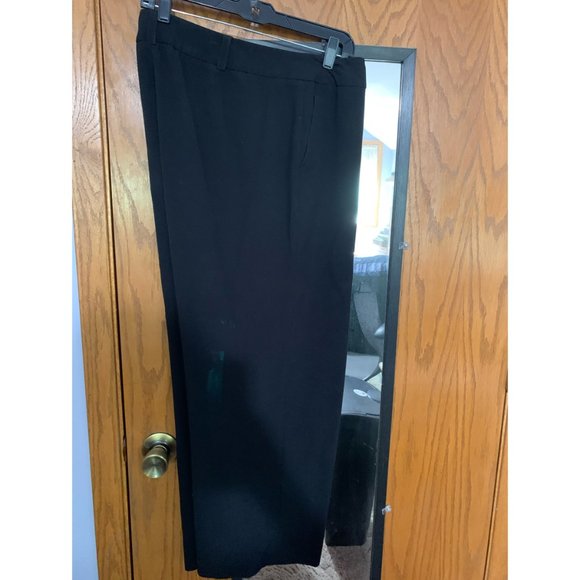
Image resolution: width=580 pixels, height=580 pixels. Identify the location of pants hanger. (307, 28).